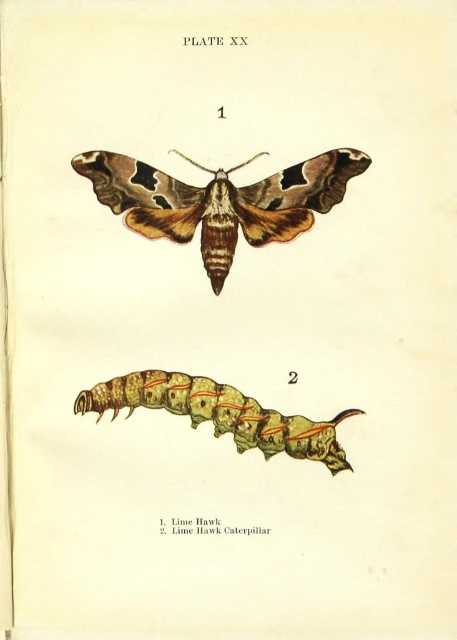
Is the position of matte brown moth at center more distant than that of greenish-yellow textured caterpillar at bottom center?

No, it is in front of greenish-yellow textured caterpillar at bottom center.

This screenshot has width=457, height=640. Describe the element at coordinates (219, 202) in the screenshot. I see `matte brown moth at center` at that location.

Measure the distance between point (244, 221) and camera.

A distance of 1.14 meters exists between point (244, 221) and camera.

Where is `matte brown moth at center`? matte brown moth at center is located at coordinates (219, 202).